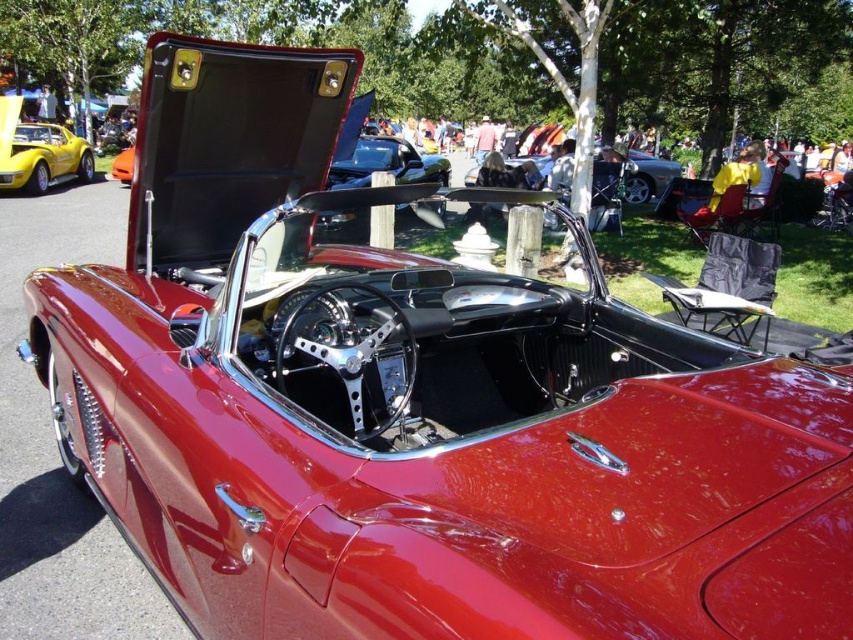
Question: Is shiny yellow convertible at left smaller than shiny black convertible at center?

Choices:
 (A) yes
 (B) no

Answer: (A)

Question: Is shiny yellow convertible at left smaller than shiny black convertible at center?

Choices:
 (A) yes
 (B) no

Answer: (A)

Question: Which of the following is the closest to the observer?

Choices:
 (A) shiny black convertible at center
 (B) shiny yellow convertible at left

Answer: (A)

Question: Can you confirm if shiny yellow convertible at left is positioned below shiny black convertible at center?

Choices:
 (A) no
 (B) yes

Answer: (A)

Question: Which point is farther from the camera taking this photo?

Choices:
 (A) (x=77, y=150)
 (B) (x=415, y=182)

Answer: (A)